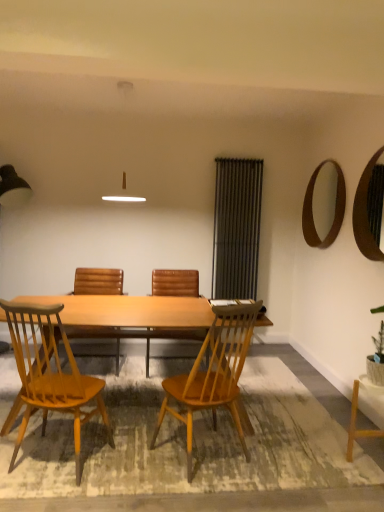
Measure the distance between light brown wood chair at center, marked as the 4th chair in a back-to-front arrangement, and camera.

light brown wood chair at center, marked as the 4th chair in a back-to-front arrangement, is 2.08 meters away from camera.

This screenshot has height=512, width=384. Describe the element at coordinates (50, 374) in the screenshot. I see `light brown wood chair at center, the first chair when ordered from front to back` at that location.

What do you see at coordinates (365, 214) in the screenshot?
I see `wooden mirror at upper right` at bounding box center [365, 214].

What do you see at coordinates (98, 281) in the screenshot? I see `wooden textured chair at center, positioned as the 4th chair in front-to-back order` at bounding box center [98, 281].

The image size is (384, 512). What do you see at coordinates (129, 311) in the screenshot? I see `light wood desk at center` at bounding box center [129, 311].

Where is `light brown wood chair at center, which is counted as the third chair, starting from the back`? The width and height of the screenshot is (384, 512). light brown wood chair at center, which is counted as the third chair, starting from the back is located at coordinates (213, 373).

I want to click on light brown wood chair at center, the first chair when ordered from front to back, so click(x=50, y=374).

Who is taller, metallic silver screen door at right or brown leather chair at center, which is the second chair from back to front?

Standing taller between the two is metallic silver screen door at right.

From a real-world perspective, is metallic silver screen door at right located beneath brown leather chair at center, which is the second chair from back to front?

No.

In terms of width, does metallic silver screen door at right look wider or thinner when compared to brown leather chair at center, which is the second chair from back to front?

metallic silver screen door at right is thinner than brown leather chair at center, which is the second chair from back to front.

Where is `screen door behind the brown leather chair at center, which is the second chair from back to front`? screen door behind the brown leather chair at center, which is the second chair from back to front is located at coordinates (236, 228).

Locate an element on the screen. The width and height of the screenshot is (384, 512). houseplant above the brown leather chair at center, the 3th chair from the front (from the image's perspective) is located at coordinates (377, 359).

How many degrees apart are the facing directions of green leafy plant at lower right and brown leather chair at center, which is the second chair from back to front?

90.4 degrees.

Which object is closer to the camera taking this photo, green leafy plant at lower right or brown leather chair at center, which is the second chair from back to front?

green leafy plant at lower right.

Considering the relative sizes of green leafy plant at lower right and brown leather chair at center, the 3th chair from the front, in the image provided, is green leafy plant at lower right smaller than brown leather chair at center, the 3th chair from the front,?

Yes, green leafy plant at lower right is smaller than brown leather chair at center, the 3th chair from the front.

Is light brown wood chair at center, marked as the 4th chair in a back-to-front arrangement, a part of wooden mirror at upper right?

Definitely not — light brown wood chair at center, marked as the 4th chair in a back-to-front arrangement, is not inside wooden mirror at upper right.

Considering the sizes of objects wooden mirror at upper right and light brown wood chair at center, marked as the 4th chair in a back-to-front arrangement, in the image provided, who is bigger, wooden mirror at upper right or light brown wood chair at center, marked as the 4th chair in a back-to-front arrangement,?

light brown wood chair at center, marked as the 4th chair in a back-to-front arrangement, is bigger.

Is wooden mirror at upper right positioned far away from light brown wood chair at center, marked as the 4th chair in a back-to-front arrangement?

Absolutely, wooden mirror at upper right is distant from light brown wood chair at center, marked as the 4th chair in a back-to-front arrangement.

Is wooden mirror at upper right facing away from light brown wood chair at center, the first chair when ordered from front to back?

wooden mirror at upper right is not turned away from light brown wood chair at center, the first chair when ordered from front to back.

From a real-world perspective, is light wood desk at center physically located above or below light brown wood chair at center, the first chair when ordered from front to back?

light wood desk at center is situated lower than light brown wood chair at center, the first chair when ordered from front to back, in the real world.

Is light wood desk at center directly adjacent to light brown wood chair at center, marked as the 4th chair in a back-to-front arrangement?

No, light wood desk at center is not making contact with light brown wood chair at center, marked as the 4th chair in a back-to-front arrangement.

Does point (173, 302) come farther from viewer compared to point (92, 398)?

Yes.

Which is correct: light wood desk at center is inside light brown wood chair at center, marked as the 4th chair in a back-to-front arrangement, or outside of it?

light wood desk at center lies outside light brown wood chair at center, marked as the 4th chair in a back-to-front arrangement.

Identify the location of mirror above the light wood desk at center (from a real-world perspective). (365, 214).

Is the depth of wooden mirror at upper right less than that of light wood desk at center?

No, it is not.

In the scene shown: Which object is positioned more to the right, wooden mirror at upper right or light wood desk at center?

From the viewer's perspective, wooden mirror at upper right appears more on the right side.

Does light brown wood chair at center, the first chair when ordered from front to back, have a lesser width compared to metallic silver screen door at right?

In fact, light brown wood chair at center, the first chair when ordered from front to back, might be wider than metallic silver screen door at right.

Can you confirm if light brown wood chair at center, marked as the 4th chair in a back-to-front arrangement, is positioned to the right of metallic silver screen door at right?

No, light brown wood chair at center, marked as the 4th chair in a back-to-front arrangement, is not to the right of metallic silver screen door at right.

From a real-world perspective, which is physically below, light brown wood chair at center, the first chair when ordered from front to back, or metallic silver screen door at right?

In real-world perspective, light brown wood chair at center, the first chair when ordered from front to back, is lower.

Find the location of `screen door above the light brown wood chair at center, marked as the 4th chair in a back-to-front arrangement (from a real-world perspective)`. screen door above the light brown wood chair at center, marked as the 4th chair in a back-to-front arrangement (from a real-world perspective) is located at coordinates (236, 228).

Where is `chair that is the 4th object above the light wood desk at center (from a real-world perspective)`? This screenshot has width=384, height=512. chair that is the 4th object above the light wood desk at center (from a real-world perspective) is located at coordinates (50, 374).

Which is less distant, (23, 437) or (205, 311)?

The point (23, 437) is more forward.

Which object is thinner, light brown wood chair at center, the first chair when ordered from front to back, or light wood desk at center?

light brown wood chair at center, the first chair when ordered from front to back.

This screenshot has height=512, width=384. I want to click on the 2nd chair to the left when counting from the metallic silver screen door at right, so click(x=175, y=283).

Where is `houseplant above the brown leather chair at center, the 3th chair from the front (from the image's perspective)`? The image size is (384, 512). houseplant above the brown leather chair at center, the 3th chair from the front (from the image's perspective) is located at coordinates (377, 359).

Looking at the image, which one is located closer to light brown wood chair at center, arranged as the second chair when viewed from the front, wooden mirror at upper right or light wood desk at center?

Based on the image, light wood desk at center appears to be nearer to light brown wood chair at center, arranged as the second chair when viewed from the front.

Estimate the real-world distances between objects in this image. Which object is closer to light wood desk at center, light brown wood chair at center, marked as the 4th chair in a back-to-front arrangement, or wooden textured chair at center, positioned as the 4th chair in front-to-back order?

light brown wood chair at center, marked as the 4th chair in a back-to-front arrangement, lies closer to light wood desk at center than the other object.

Based on their spatial positions, is green leafy plant at lower right or light wood desk at center further from wooden mirror at upper right?

light wood desk at center is positioned further to the anchor wooden mirror at upper right.

Considering their positions, is wooden textured chair at center, positioned as the 4th chair in front-to-back order, positioned closer to wooden mirror at upper right than green leafy plant at lower right?

green leafy plant at lower right lies closer to wooden mirror at upper right than the other object.

Based on their spatial positions, is light brown wood chair at center, marked as the 4th chair in a back-to-front arrangement, or green leafy plant at lower right closer to brown leather chair at center, the 3th chair from the front?

Among the two, light brown wood chair at center, marked as the 4th chair in a back-to-front arrangement, is located nearer to brown leather chair at center, the 3th chair from the front.

Based on the photo, when comparing their distances from wooden textured chair at center, the first chair in the back-to-front sequence, does green leafy plant at lower right or brown leather chair at center, the 3th chair from the front, seem closer?

brown leather chair at center, the 3th chair from the front, lies closer to wooden textured chair at center, the first chair in the back-to-front sequence, than the other object.

Based on their spatial positions, is light brown wood chair at center, arranged as the second chair when viewed from the front, or wooden mirror at upper right further from light wood desk at center?

Among the two, wooden mirror at upper right is located further to light wood desk at center.

Looking at the image, which one is located further to wooden mirror at upper right, brown leather chair at center, which is the second chair from back to front, or wooden textured chair at center, the first chair in the back-to-front sequence?

Based on the image, wooden textured chair at center, the first chair in the back-to-front sequence, appears to be further to wooden mirror at upper right.

Where is `desk between light brown wood chair at center, which is counted as the third chair, starting from the back, and brown leather chair at center, the 3th chair from the front, in the front-back direction`? desk between light brown wood chair at center, which is counted as the third chair, starting from the back, and brown leather chair at center, the 3th chair from the front, in the front-back direction is located at coordinates (129, 311).

Identify the location of screen door located between wooden textured chair at center, the first chair in the back-to-front sequence, and wooden mirror at upper right in the left-right direction. This screenshot has width=384, height=512. (236, 228).

You are a GUI agent. You are given a task and a screenshot of the screen. Output one action in this format:
    pyautogui.click(x=<x>, y=<y>)
    Task: Click on the desk between light brown wood chair at center, marked as the 4th chair in a back-to-front arrangement, and green leafy plant at lower right, in the horizontal direction
    
    Given the screenshot: What is the action you would take?
    pyautogui.click(x=129, y=311)

In order to click on mirror between green leafy plant at lower right and metallic silver screen door at right along the z-axis in this screenshot , I will do `click(365, 214)`.